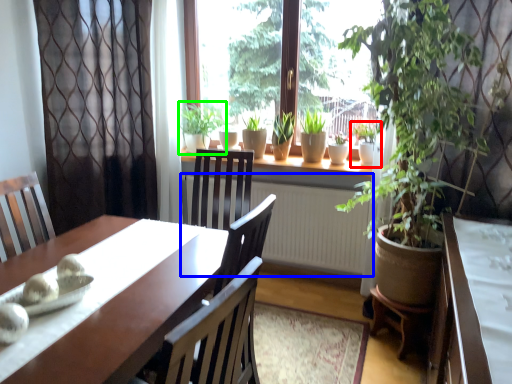
Question: Which is farther away from houseplant (highlighted by a red box)? radiator (highlighted by a blue box) or houseplant (highlighted by a green box)?

Choices:
 (A) radiator
 (B) houseplant

Answer: (B)